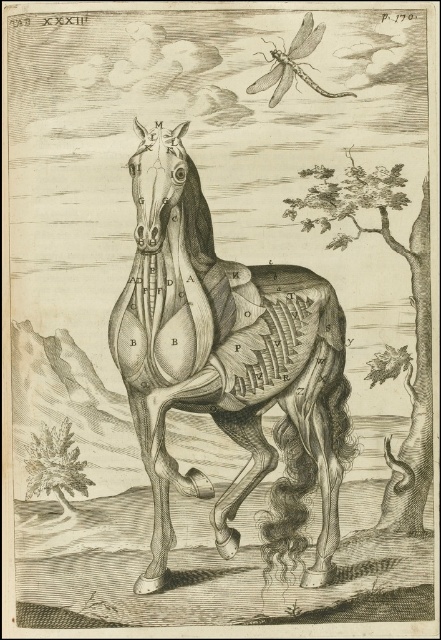
Question: Among these objects, which one is nearest to the camera?

Choices:
 (A) gray textured horse at center
 (B) translucent gray dragonfly at upper center

Answer: (A)

Question: Can you confirm if gray textured horse at center is bigger than translucent gray dragonfly at upper center?

Choices:
 (A) yes
 (B) no

Answer: (A)

Question: Can you confirm if gray textured horse at center is smaller than translucent gray dragonfly at upper center?

Choices:
 (A) yes
 (B) no

Answer: (B)

Question: Is the position of gray textured horse at center less distant than that of translucent gray dragonfly at upper center?

Choices:
 (A) yes
 (B) no

Answer: (A)